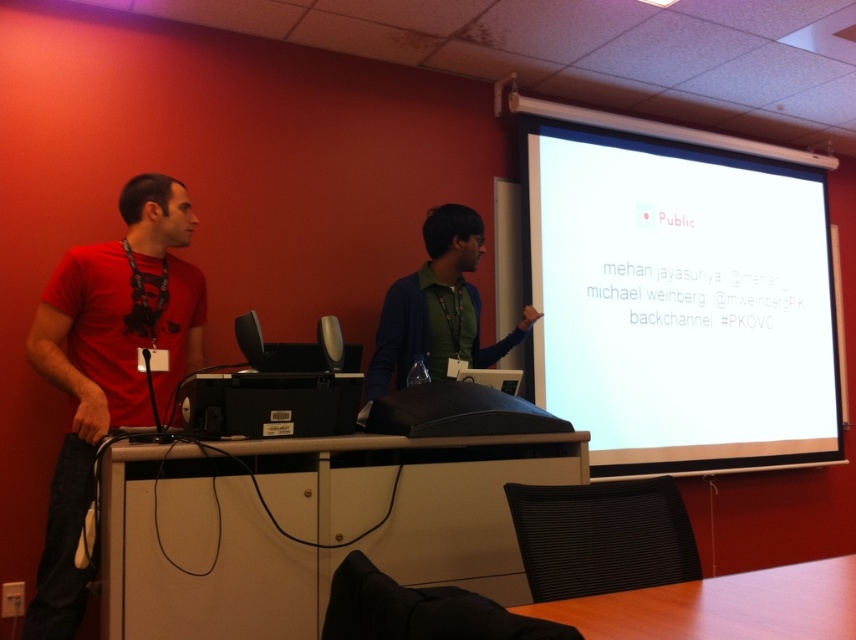
Between white glossy table at lower center and green matte shirt at center, which one has more height?

green matte shirt at center is taller.

Is white glossy table at lower center further to camera compared to green matte shirt at center?

No, white glossy table at lower center is in front of green matte shirt at center.

Locate an element on the screen. The height and width of the screenshot is (640, 856). white glossy table at lower center is located at coordinates (307, 525).

Does white glossy projection screen at upper right appear under white glossy table at lower center?

No, white glossy projection screen at upper right is not below white glossy table at lower center.

Which is more to the right, white glossy projection screen at upper right or white glossy table at lower center?

From the viewer's perspective, white glossy projection screen at upper right appears more on the right side.

Who is more distant from viewer, (642, 432) or (284, 625)?

The point (642, 432) is behind.

Locate an element on the screen. Image resolution: width=856 pixels, height=640 pixels. white glossy projection screen at upper right is located at coordinates (681, 301).

Does point (377, 541) come farther from viewer compared to point (441, 385)?

No, it is in front of (441, 385).

Can you confirm if white glossy table at lower center is positioned to the right of black matte projector at center?

No, white glossy table at lower center is not to the right of black matte projector at center.

Is point (498, 468) positioned after point (453, 385)?

No, (498, 468) is closer to viewer.

Find the location of a particular element. This screenshot has width=856, height=640. white glossy table at lower center is located at coordinates (307, 525).